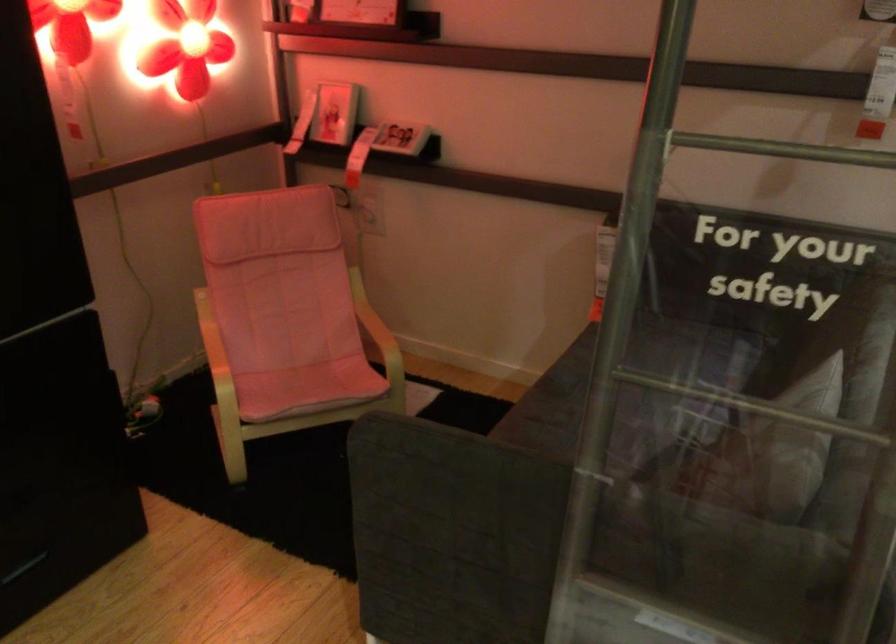
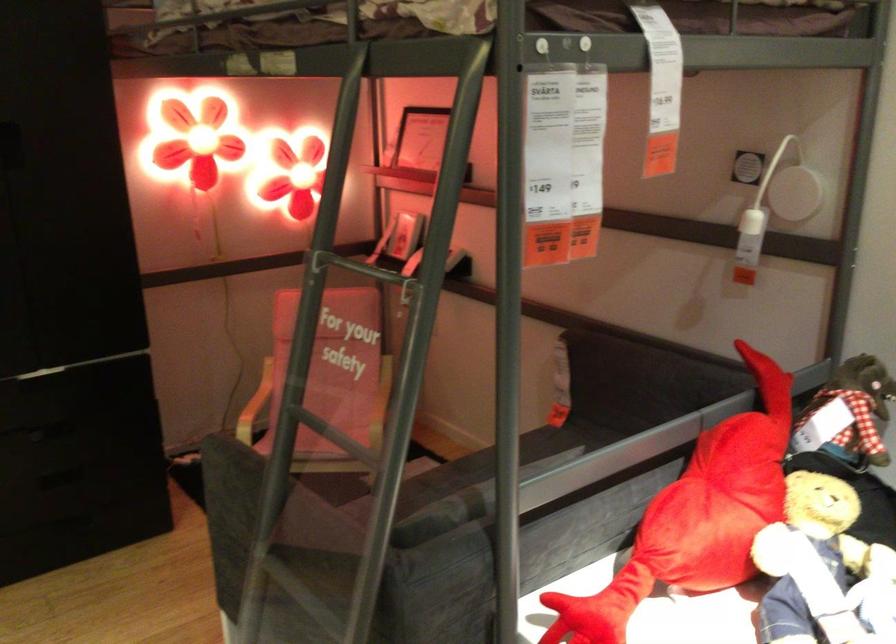
The point at [770,147] is marked in the first image. Where is the corresponding point in the second image?

(354, 267)